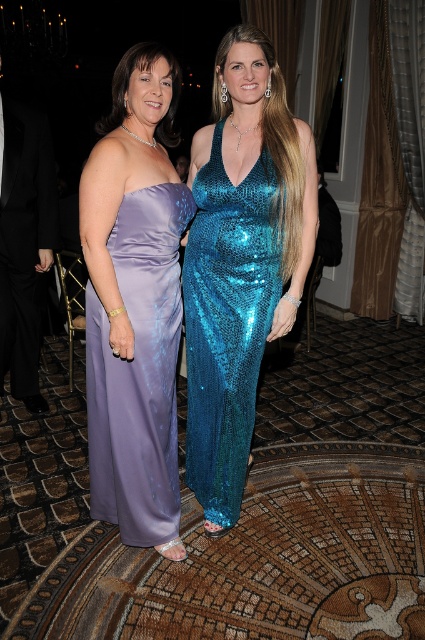
Question: Among these points, which one is farthest from the camera?

Choices:
 (A) (113, 388)
 (B) (223, 244)

Answer: (B)

Question: Which object is farther from the camera taking this photo?

Choices:
 (A) shiny teal sequined dress at center
 (B) satin dress at center

Answer: (A)

Question: Can you confirm if satin dress at center is positioned to the left of shiny teal sequined dress at center?

Choices:
 (A) no
 (B) yes

Answer: (B)

Question: Does satin dress at center appear over shiny teal sequined dress at center?

Choices:
 (A) no
 (B) yes

Answer: (A)

Question: In this image, where is satin dress at center located relative to shiny teal sequined dress at center?

Choices:
 (A) above
 (B) below

Answer: (B)

Question: Which point appears closest to the camera in this image?

Choices:
 (A) (246, 212)
 (B) (156, 317)

Answer: (B)